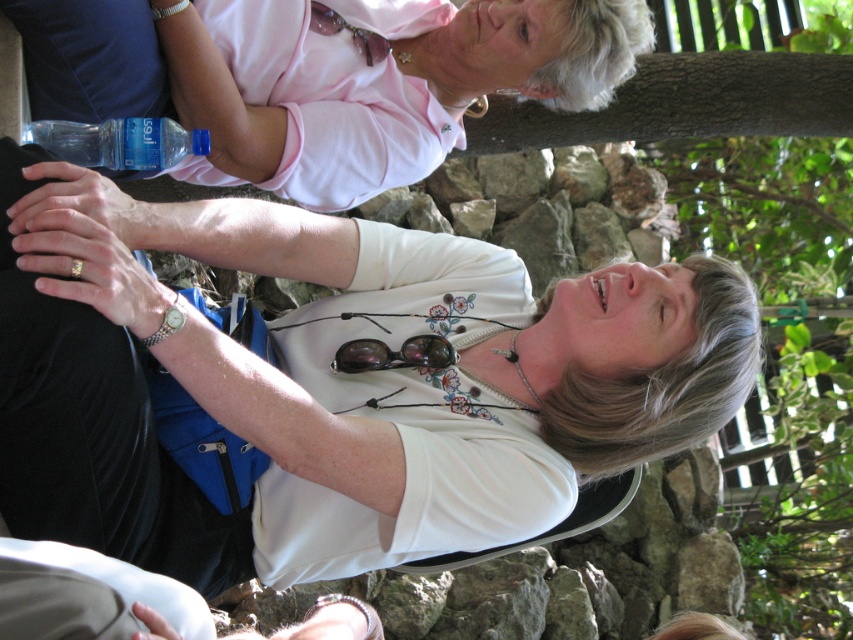
Question: Can you confirm if white matte shirt at center is bigger than pink fabric shirt at upper center?

Choices:
 (A) no
 (B) yes

Answer: (B)

Question: Which of the following is the farthest from the observer?

Choices:
 (A) matte black goggles at center
 (B) pink fabric shirt at upper center
 (C) white matte shirt at center

Answer: (A)

Question: Considering the real-world distances, which object is closest to the pink fabric shirt at upper center?

Choices:
 (A) matte black goggles at center
 (B) white matte shirt at center

Answer: (B)

Question: Which point is farther to the camera?

Choices:
 (A) (366, 346)
 (B) (456, 305)

Answer: (B)

Question: Is white matte shirt at center below pink fabric shirt at upper center?

Choices:
 (A) no
 (B) yes

Answer: (B)

Question: Is white matte shirt at center to the left of matte black goggles at center from the viewer's perspective?

Choices:
 (A) no
 (B) yes

Answer: (B)